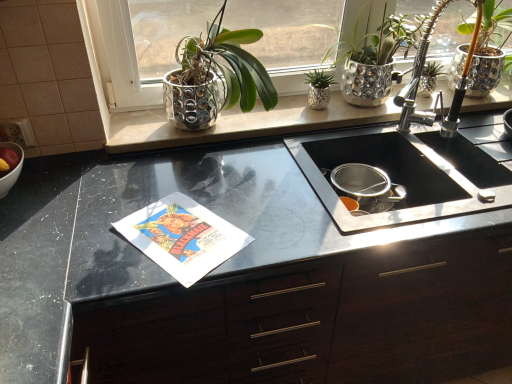
Where is `free point to the right of white glossy bowl at left`? free point to the right of white glossy bowl at left is located at coordinates (50, 205).